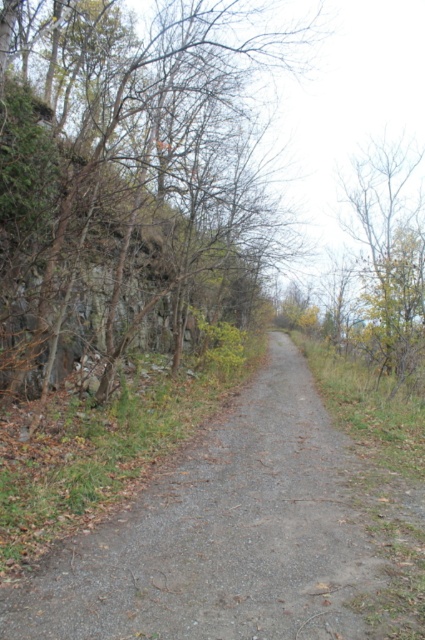
Question: Can you confirm if brown bark tree at center is positioned below gray gravel path at center?

Choices:
 (A) no
 (B) yes

Answer: (A)

Question: Is brown bark tree at center positioned at the back of gray gravel path at center?

Choices:
 (A) no
 (B) yes

Answer: (B)

Question: Does brown bark tree at center have a lesser width compared to gray gravel path at center?

Choices:
 (A) no
 (B) yes

Answer: (A)